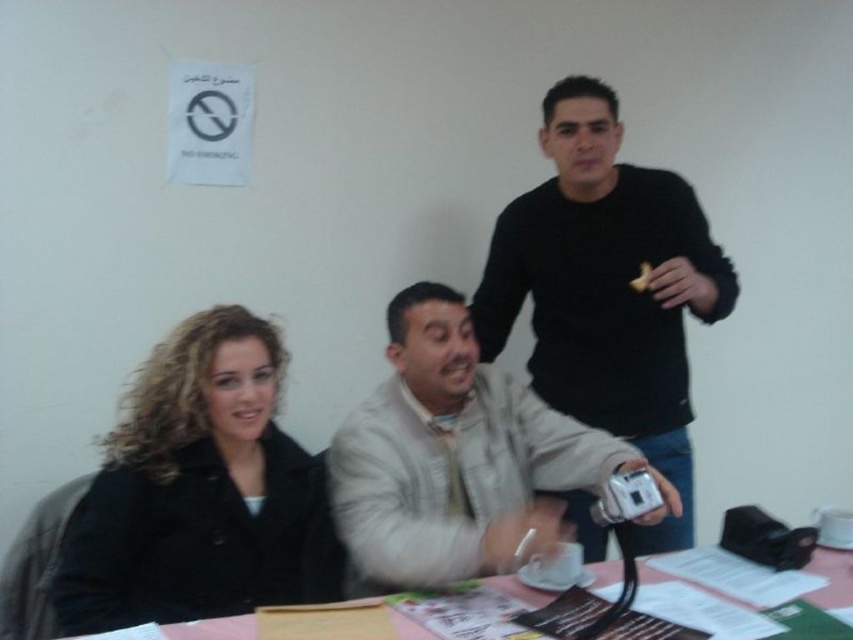
Which of these two, black matte jacket at left or beige textured jacket at center, stands shorter?

black matte jacket at left

Describe the element at coordinates (199, 492) in the screenshot. This screenshot has width=853, height=640. I see `black matte jacket at left` at that location.

I want to click on black matte jacket at left, so click(199, 492).

Which is in front, point (257, 324) or point (566, 241)?

Point (257, 324)

From the picture: Can you confirm if black matte jacket at left is wider than black matte sweater at upper right?

In fact, black matte jacket at left might be narrower than black matte sweater at upper right.

The width and height of the screenshot is (853, 640). What do you see at coordinates (199, 492) in the screenshot?
I see `black matte jacket at left` at bounding box center [199, 492].

Identify the location of black matte jacket at left. [x=199, y=492].

Can you confirm if black matte jacket at left is thinner than pink plastic table at lower center?

Correct, black matte jacket at left's width is less than pink plastic table at lower center's.

Does black matte jacket at left appear on the left side of pink plastic table at lower center?

Yes, black matte jacket at left is to the left of pink plastic table at lower center.

Is point (91, 621) positioned in front of point (845, 572)?

Yes, point (91, 621) is closer to viewer.

Locate an element on the screen. The width and height of the screenshot is (853, 640). black matte jacket at left is located at coordinates (199, 492).